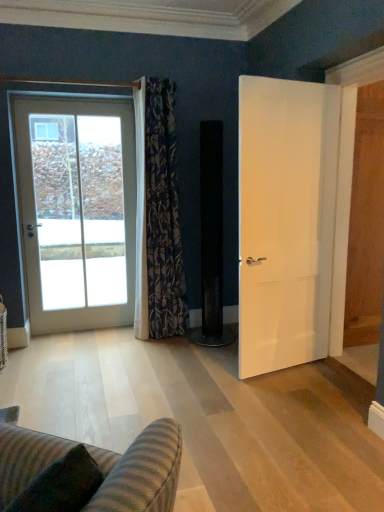
Question: From a real-world perspective, is white glass door at left, which ranks as the 1th door in back-to-front order, positioned under white matte door at right, the 2th door in the left-to-right sequence, based on gravity?

Choices:
 (A) no
 (B) yes

Answer: (A)

Question: Is white glass door at left, which ranks as the 1th door in back-to-front order, shorter than white matte door at right, the 2th door in the left-to-right sequence?

Choices:
 (A) yes
 (B) no

Answer: (B)

Question: Is white glass door at left, which ranks as the 1th door in back-to-front order, smaller than white matte door at right, placed as the 1th door when sorted from right to left?

Choices:
 (A) no
 (B) yes

Answer: (A)

Question: Can you confirm if white glass door at left, acting as the second door starting from the front, is taller than white matte door at right, placed as the 1th door when sorted from right to left?

Choices:
 (A) yes
 (B) no

Answer: (A)

Question: Is white glass door at left, which ranks as the 1th door in back-to-front order, looking in the opposite direction of white matte door at right, placed as the 1th door when sorted from right to left?

Choices:
 (A) no
 (B) yes

Answer: (A)

Question: Is white matte door at right, the first door in the front-to-back sequence, to the left or to the right of white glass door at left, which ranks as the 1th door in back-to-front order, in the image?

Choices:
 (A) right
 (B) left

Answer: (A)

Question: Is white matte door at right, placed as the 1th door when sorted from right to left, taller or shorter than white glass door at left, acting as the second door starting from the front?

Choices:
 (A) short
 (B) tall

Answer: (A)

Question: From the image's perspective, is white matte door at right, which is the 2th door from back to front, located above or below white glass door at left, which is counted as the 1th door, starting from the left?

Choices:
 (A) below
 (B) above

Answer: (A)

Question: In terms of width, does white matte door at right, placed as the 1th door when sorted from right to left, look wider or thinner when compared to white glass door at left, which ranks as the 1th door in back-to-front order?

Choices:
 (A) thin
 (B) wide

Answer: (A)

Question: Considering the relative positions of white matte door at right, the 2th door in the left-to-right sequence, and striped fabric couch at lower left in the image provided, is white matte door at right, the 2th door in the left-to-right sequence, to the left or to the right of striped fabric couch at lower left?

Choices:
 (A) left
 (B) right

Answer: (B)

Question: Is white matte door at right, the first door in the front-to-back sequence, bigger or smaller than striped fabric couch at lower left?

Choices:
 (A) big
 (B) small

Answer: (A)

Question: From their relative heights in the image, would you say white matte door at right, the 2th door in the left-to-right sequence, is taller or shorter than striped fabric couch at lower left?

Choices:
 (A) tall
 (B) short

Answer: (A)

Question: Do you think white matte door at right, placed as the 1th door when sorted from right to left, is within striped fabric couch at lower left, or outside of it?

Choices:
 (A) outside
 (B) inside

Answer: (A)

Question: From the image's perspective, is floral-patterned fabric curtain at left located above or below white matte door at right, the first door in the front-to-back sequence?

Choices:
 (A) below
 (B) above

Answer: (B)

Question: From a real-world perspective, is floral-patterned fabric curtain at left above or below white matte door at right, which is the 2th door from back to front?

Choices:
 (A) below
 (B) above

Answer: (B)